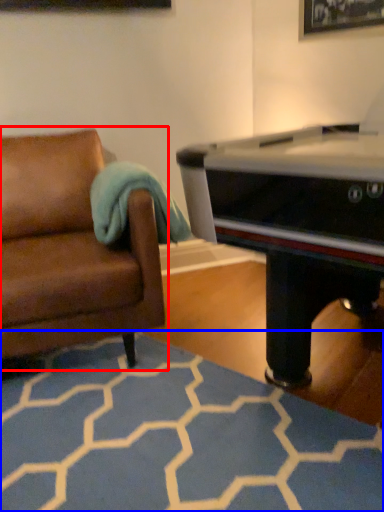
Question: Which point is further to the camera, studio couch (highlighted by a red box) or plain (highlighted by a blue box)?

Choices:
 (A) studio couch
 (B) plain

Answer: (A)